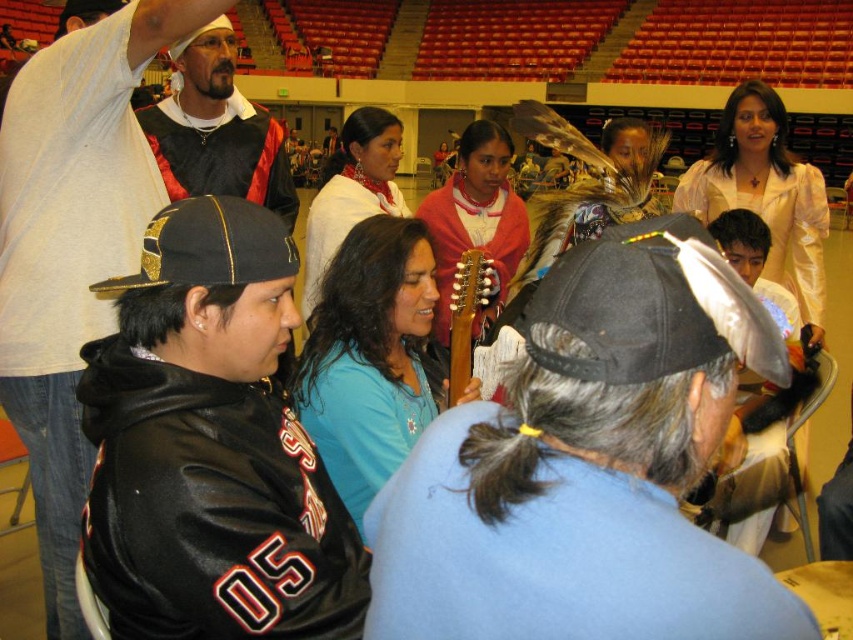
You are attending an event in the described hall and notice two items of clothing. The first is a black fabric baseball cap at center, and the second is a matte black and red fabric at upper left. From your perspective, which item is located to the right of the other?

The black fabric baseball cap at center is positioned on the right side of matte black and red fabric at upper left.

You are standing in the auditorium and notice two points marked in the scene. Which point, point (596, 353) or point (184, 67), is closer to you?

Point (596, 353) is closer to the viewer than point (184, 67).

You are standing at the entrance of the auditorium and want to find the black leather jacket at lower left. According to the coordinates provided, where should you look relative to the center of the image?

The black leather jacket at lower left is located at coordinates point (73, 243), which means it is positioned to the left and slightly below the center of the image.